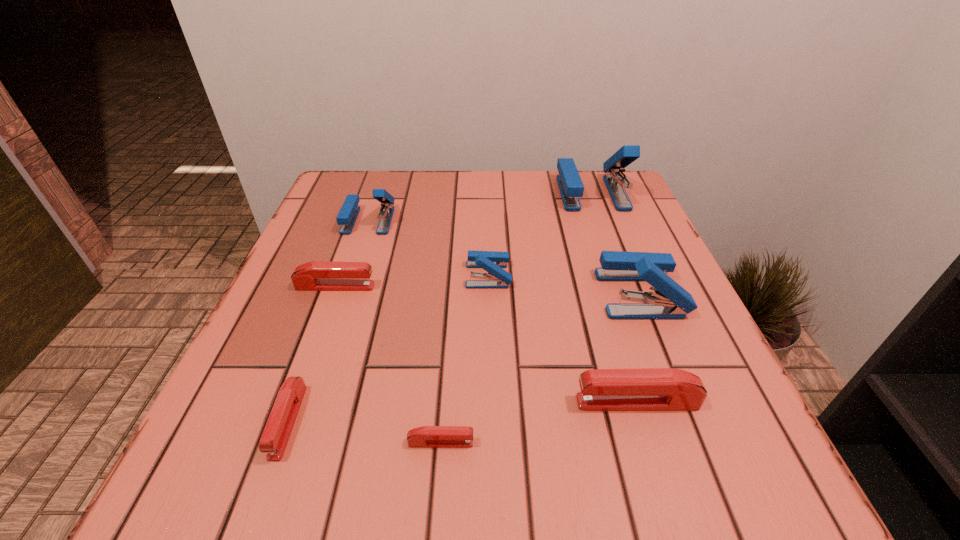
Locate an element on the screen. red stapler that is the fourth closest one to the smallest blue stapler is located at coordinates (277, 431).

Where is `free point that satisfies the following two spatial constraints: 1. on the front side of the smallest blue stapler; 2. on the front-facing side of the third shortest stapler`? free point that satisfies the following two spatial constraints: 1. on the front side of the smallest blue stapler; 2. on the front-facing side of the third shortest stapler is located at coordinates (489, 287).